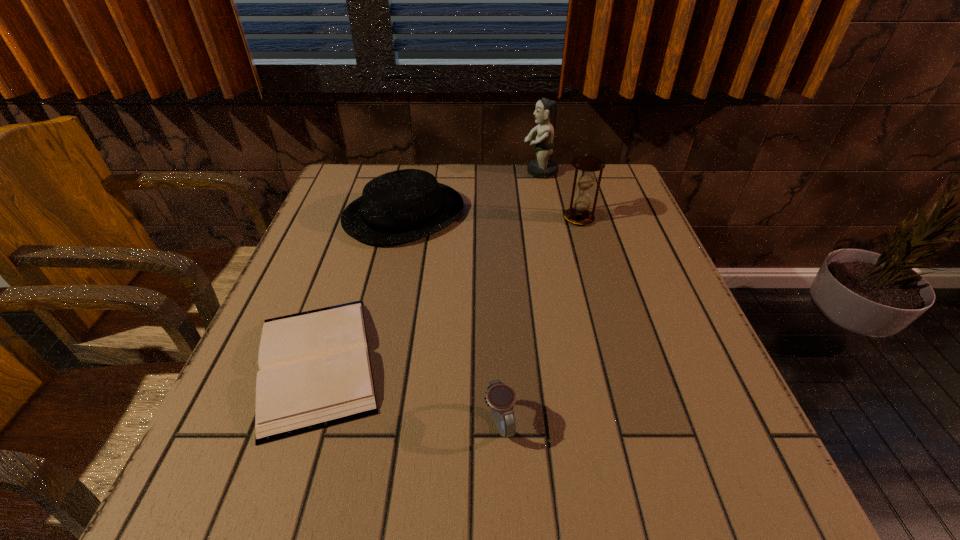
Locate an element on the screen. blank area in the image that satisfies the following two spatial constraints: 1. on the back side of the fourth shortest object; 2. on the left side of the shortest object is located at coordinates [x=366, y=218].